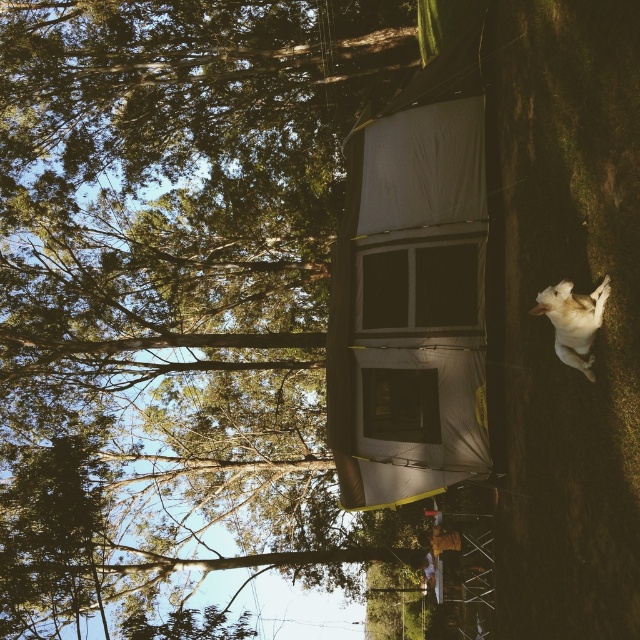
Is transparent fabric window at center bigger than white fur dog at lower right?

Indeed, transparent fabric window at center has a larger size compared to white fur dog at lower right.

Is transparent fabric window at center below white fur dog at lower right?

No, transparent fabric window at center is not below white fur dog at lower right.

The width and height of the screenshot is (640, 640). In order to click on transparent fabric window at center in this screenshot , I will do `click(420, 285)`.

Based on the photo, does transparent plastic window at center have a larger size compared to white fur dog at lower right?

Yes, transparent plastic window at center is bigger than white fur dog at lower right.

Does transparent plastic window at center appear on the right side of white fur dog at lower right?

No, transparent plastic window at center is not to the right of white fur dog at lower right.

At what (x,y) coordinates should I click in order to perform the action: click on transparent plastic window at center. Please return your answer as a coordinate pair (x, y). The image size is (640, 640). Looking at the image, I should click on (401, 404).

Does green leafy tree at upper center appear under transparent fabric window at center?

Yes, green leafy tree at upper center is below transparent fabric window at center.

Who is positioned more to the right, green leafy tree at upper center or transparent fabric window at center?

Positioned to the right is transparent fabric window at center.

The height and width of the screenshot is (640, 640). I want to click on green leafy tree at upper center, so click(x=172, y=296).

I want to click on green leafy tree at upper center, so click(172, 296).